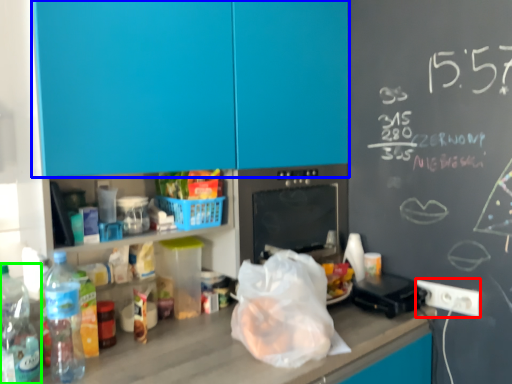
Question: Which is farther away from electric outlet (highlighted by a red box)? cabinetry (highlighted by a blue box) or bottle (highlighted by a green box)?

Choices:
 (A) cabinetry
 (B) bottle

Answer: (B)